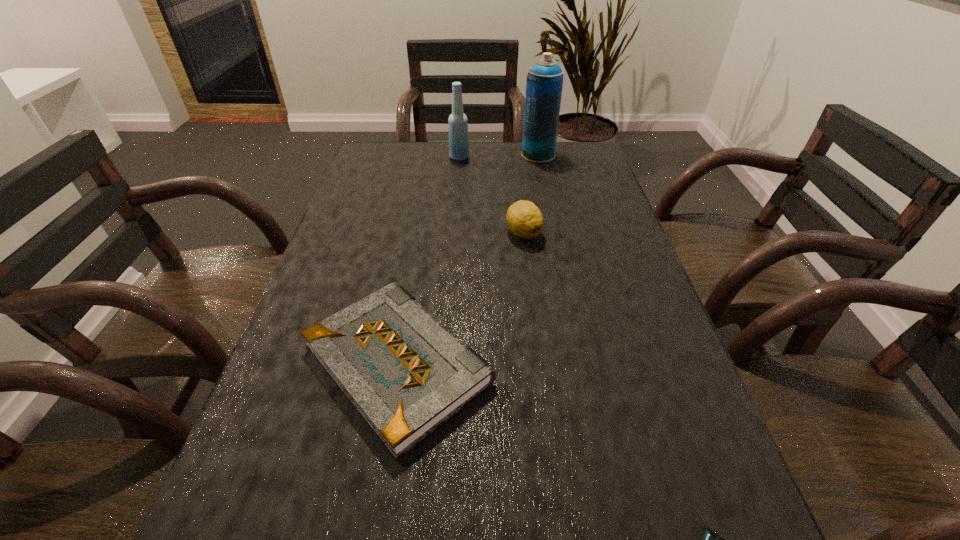
Locate an element on the screen. Image resolution: width=960 pixels, height=540 pixels. aerosol can is located at coordinates (544, 84).

Identify the location of bottle. (458, 123).

This screenshot has width=960, height=540. In order to click on the third nearest object in this screenshot , I will do `click(524, 218)`.

Locate an element on the screen. This screenshot has width=960, height=540. lemon is located at coordinates (524, 218).

At what (x,y) coordinates should I click in order to perform the action: click on notebook. Please return your answer as a coordinate pair (x, y). The width and height of the screenshot is (960, 540). Looking at the image, I should click on (406, 374).

This screenshot has height=540, width=960. Identify the location of the second shortest object. (406, 374).

You are a GUI agent. You are given a task and a screenshot of the screen. Output one action in this format:
    pyautogui.click(x=<x>, y=<y>)
    Task: Click on the free spot located 0.370m on the front of the aerosol can
    The height and width of the screenshot is (540, 960).
    Given the screenshot: What is the action you would take?
    pyautogui.click(x=555, y=235)

At what (x,y) coordinates should I click in order to perform the action: click on vacant space situated 0.190m on the right of the bottle. Please return your answer as a coordinate pair (x, y). Image resolution: width=960 pixels, height=540 pixels. Looking at the image, I should click on (529, 157).

Locate an element on the screen. vacant space located at the stem end of the third tallest object is located at coordinates pos(535,319).

I want to click on blank space located 0.100m on the front of the fourth farthest object, so click(x=369, y=533).